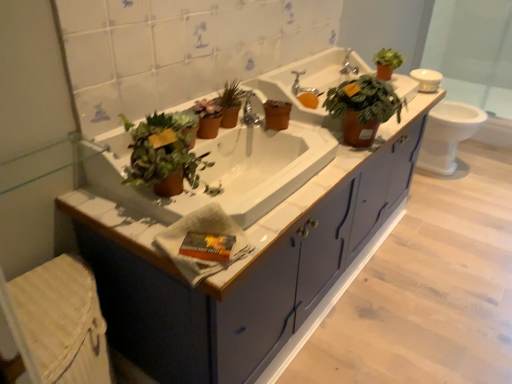
Question: Is matte brown pot at center, which is the 2th houseplant in left-to-right order, inside or outside of white glossy sink at center, which is the 1th sink in front-to-back order?

Choices:
 (A) outside
 (B) inside

Answer: (B)

Question: Looking at the image, does matte brown pot at center, which ranks as the third houseplant in right-to-left order, seem bigger or smaller compared to white glossy sink at center, which ranks as the second sink in back-to-front order?

Choices:
 (A) big
 (B) small

Answer: (B)

Question: Which is nearer to the green matte plant at center, acting as the third houseplant starting from the back?

Choices:
 (A) white glossy sink at center, which is the 1th sink in front-to-back order
 (B) white glossy toilet at right
 (C) white textured hand towel at center
 (D) silver metallic faucet at upper center, which is the 1th faucet from back to front
 (E) matte blue cabinet at center

Answer: (A)

Question: Based on their relative distances, which object is farther from the green matte plant at upper right, the 4th houseplant viewed from the front?

Choices:
 (A) white textured hand towel at center
 (B) matte ceramic sink at center, marked as the 2th sink in a front-to-back arrangement
 (C) matte blue cabinet at center
 (D) matte brown pot at center, which ranks as the third houseplant in right-to-left order
 (E) matte brown pot at center

Answer: (A)